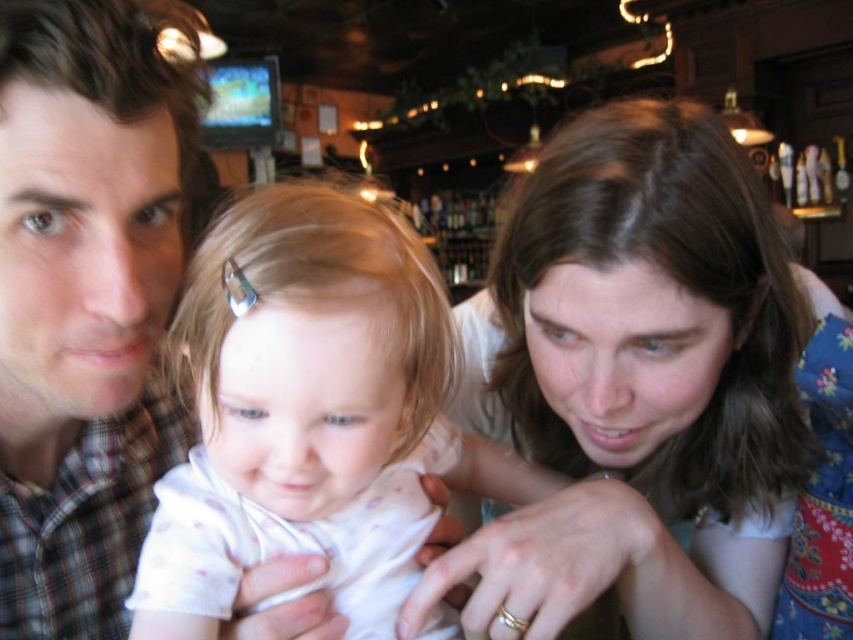
What is located at the point with coordinates (641, 385) in the image?

The point at coordinates (641, 385) marks the location of smooth brown hair at center.

You are a photographer trying to capture a candid shot of the smooth brown hair at center and the plaid shirt at left. Which object should you focus on first to ensure it appears sharp in the photo?

The smooth brown hair at center should be focused on first because it is closer to the viewer than the plaid shirt at left, ensuring it will be sharp in the photo.

You are a photographer standing in front of the camera. You want to adjust your position so that the smooth brown hair at center and the plaid shirt at left are both in focus. The camera has a depth of field that can cover 14 inches. Can you achieve this by staying in your current position?

The smooth brown hair at center is 13.84 inches from the plaid shirt at left. Since the distance between them is within the camera depth of field of 14 inches, yes, you can keep both in focus by staying in your current position.